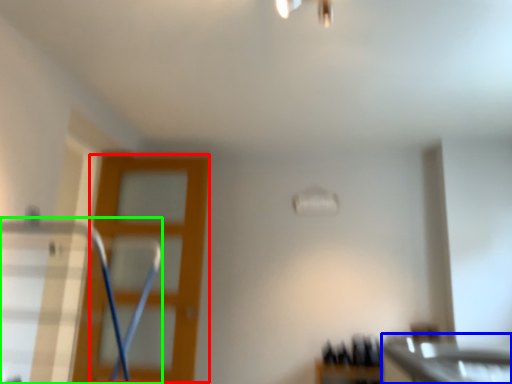
Question: Which object is the closest to the screen door (highlighted by a red box)? Choose among these: counter top (highlighted by a blue box) or swivel chair (highlighted by a green box).

Choices:
 (A) counter top
 (B) swivel chair

Answer: (B)